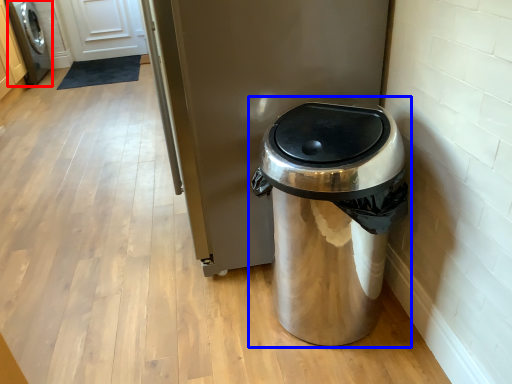
Question: Which object is further to the camera taking this photo, washing machine (highlighted by a red box) or waste container (highlighted by a blue box)?

Choices:
 (A) washing machine
 (B) waste container

Answer: (A)